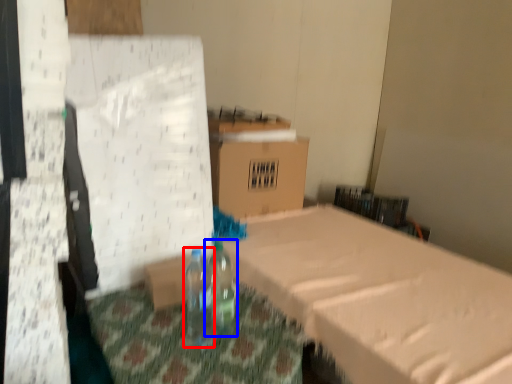
Question: Among these objects, which one is farthest to the camera, bottle (highlighted by a red box) or bottle (highlighted by a blue box)?

Choices:
 (A) bottle
 (B) bottle

Answer: (B)